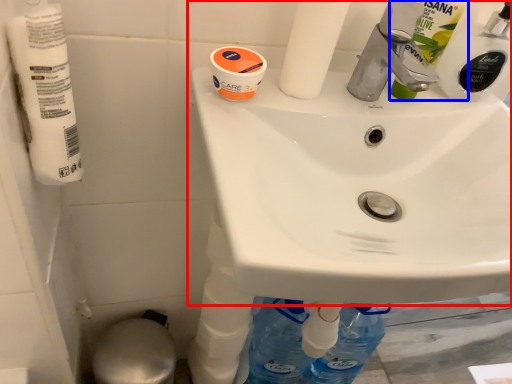
Question: Which object is closer to the camera taking this photo, sink (highlighted by a red box) or cleaning product (highlighted by a blue box)?

Choices:
 (A) sink
 (B) cleaning product

Answer: (A)